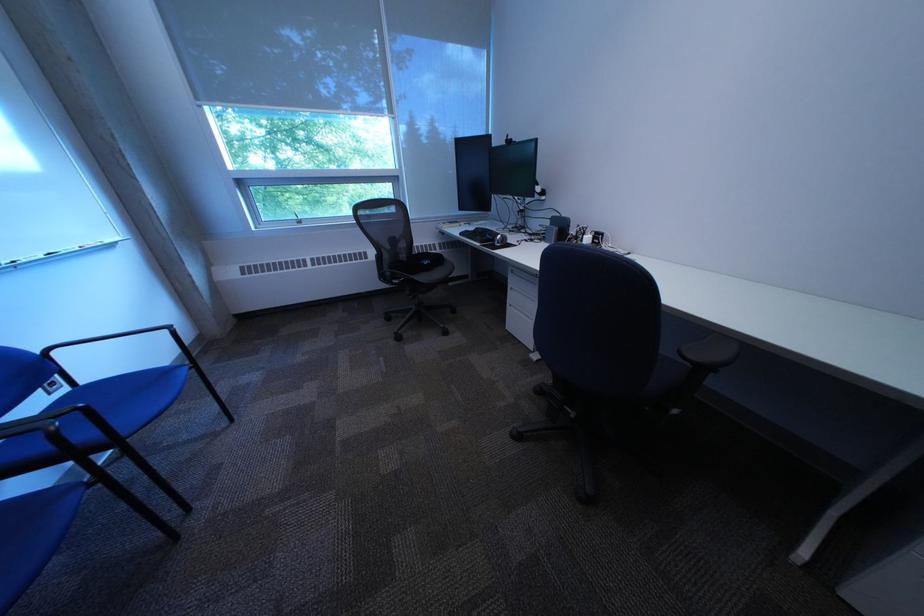
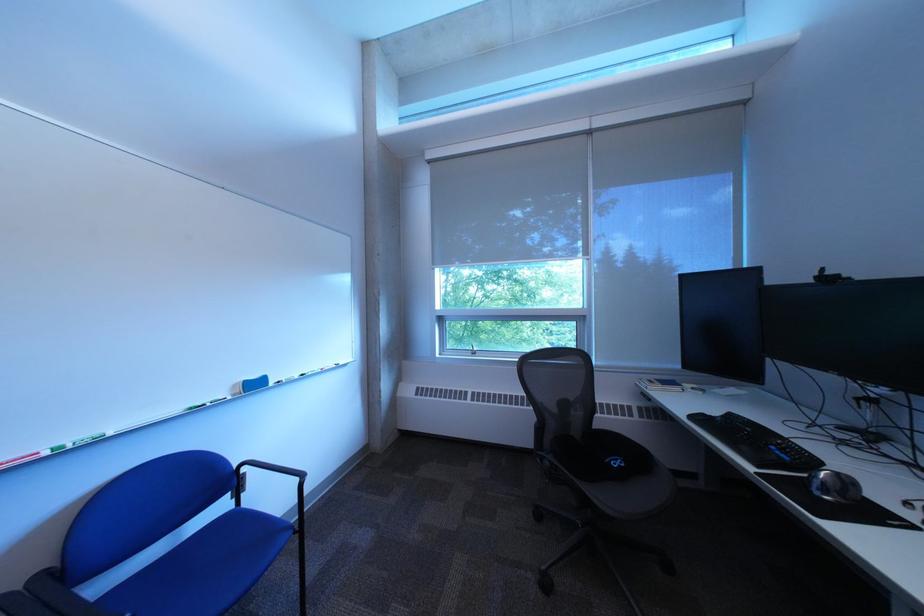
Where in the second image is the point corresponding to the point at 477,236 from the first image?

(708, 419)